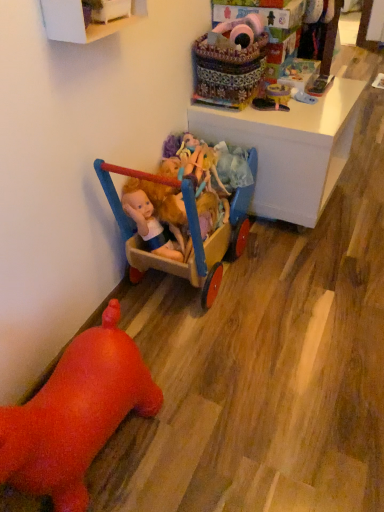
Locate an element on the screen. This screenshot has height=512, width=384. spots to the right of black rubber shoe at upper right, which is the 4th toy from bottom to top is located at coordinates (316, 110).